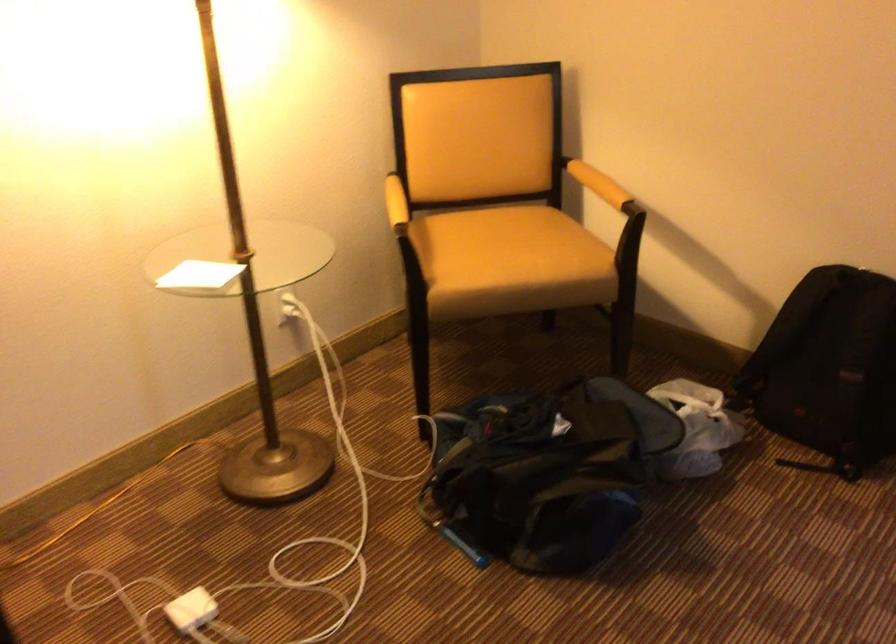
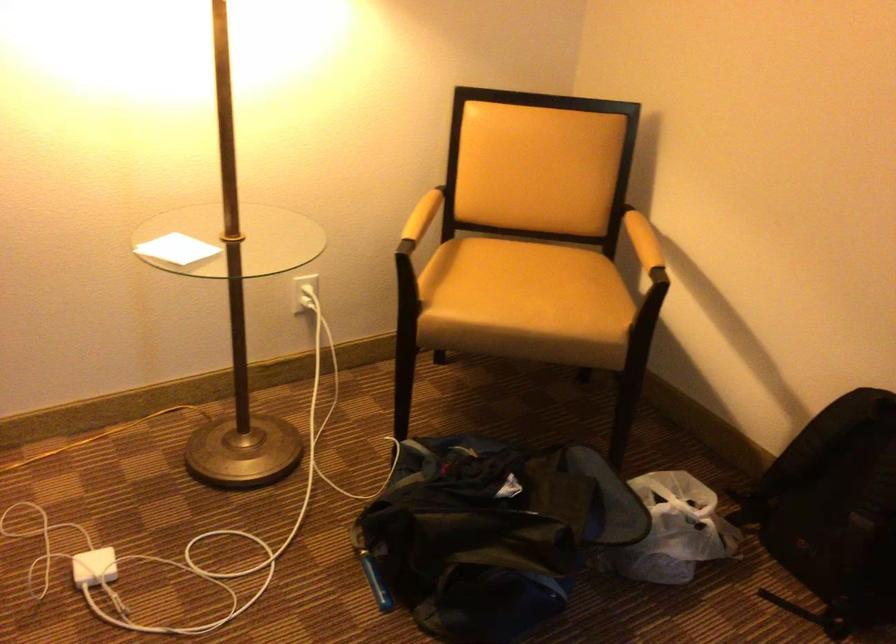
In the scene shown: What movement of the cameraman would produce the second image?

The cameraman walked toward right, forward.